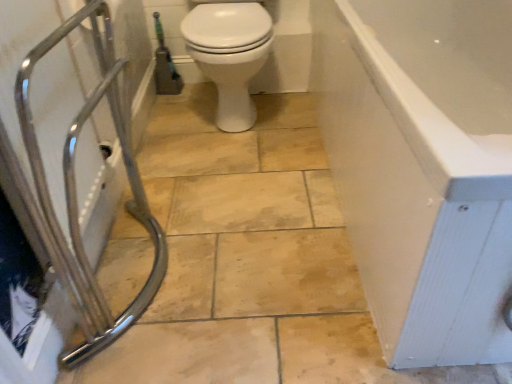
Question: From the image's perspective, is green rubber garden hose at upper left located beneath chrome metallic shower at left?

Choices:
 (A) no
 (B) yes

Answer: (A)

Question: Could you tell me if green rubber garden hose at upper left is facing chrome metallic shower at left?

Choices:
 (A) yes
 (B) no

Answer: (A)

Question: Considering the relative positions of green rubber garden hose at upper left and chrome metallic shower at left in the image provided, is green rubber garden hose at upper left to the left of chrome metallic shower at left from the viewer's perspective?

Choices:
 (A) yes
 (B) no

Answer: (A)

Question: From a real-world perspective, is green rubber garden hose at upper left on chrome metallic shower at left?

Choices:
 (A) yes
 (B) no

Answer: (B)

Question: From a real-world perspective, is green rubber garden hose at upper left positioned under chrome metallic shower at left based on gravity?

Choices:
 (A) yes
 (B) no

Answer: (A)

Question: From a real-world perspective, is chrome metallic shower at left above or below green rubber garden hose at upper left?

Choices:
 (A) below
 (B) above

Answer: (B)

Question: In terms of height, does chrome metallic shower at left look taller or shorter compared to green rubber garden hose at upper left?

Choices:
 (A) short
 (B) tall

Answer: (B)

Question: Is chrome metallic shower at left wider or thinner than green rubber garden hose at upper left?

Choices:
 (A) thin
 (B) wide

Answer: (B)

Question: Which is correct: chrome metallic shower at left is inside green rubber garden hose at upper left, or outside of it?

Choices:
 (A) outside
 (B) inside

Answer: (A)

Question: Considering the positions of point (207, 21) and point (179, 92), is point (207, 21) closer or farther from the camera than point (179, 92)?

Choices:
 (A) closer
 (B) farther

Answer: (A)

Question: Considering the positions of white glossy toilet at center and green rubber garden hose at upper left in the image, is white glossy toilet at center bigger or smaller than green rubber garden hose at upper left?

Choices:
 (A) small
 (B) big

Answer: (B)

Question: Do you think white glossy toilet at center is within green rubber garden hose at upper left, or outside of it?

Choices:
 (A) outside
 (B) inside

Answer: (A)

Question: In the image, is white glossy toilet at center positioned in front of or behind green rubber garden hose at upper left?

Choices:
 (A) front
 (B) behind

Answer: (A)

Question: From the image's perspective, is green rubber garden hose at upper left located above or below white glossy bathtub at right?

Choices:
 (A) above
 (B) below

Answer: (A)

Question: Does point (165, 79) appear closer or farther from the camera than point (455, 198)?

Choices:
 (A) farther
 (B) closer

Answer: (A)